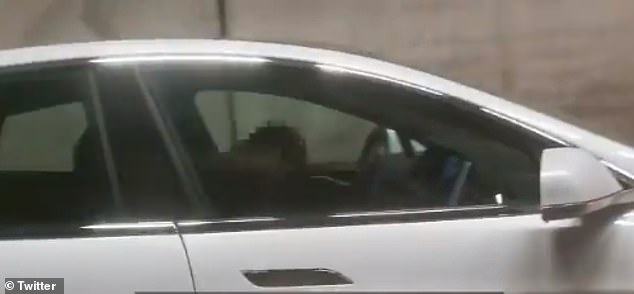
This screenshot has width=634, height=294. I want to click on front right window, so click(339, 123).